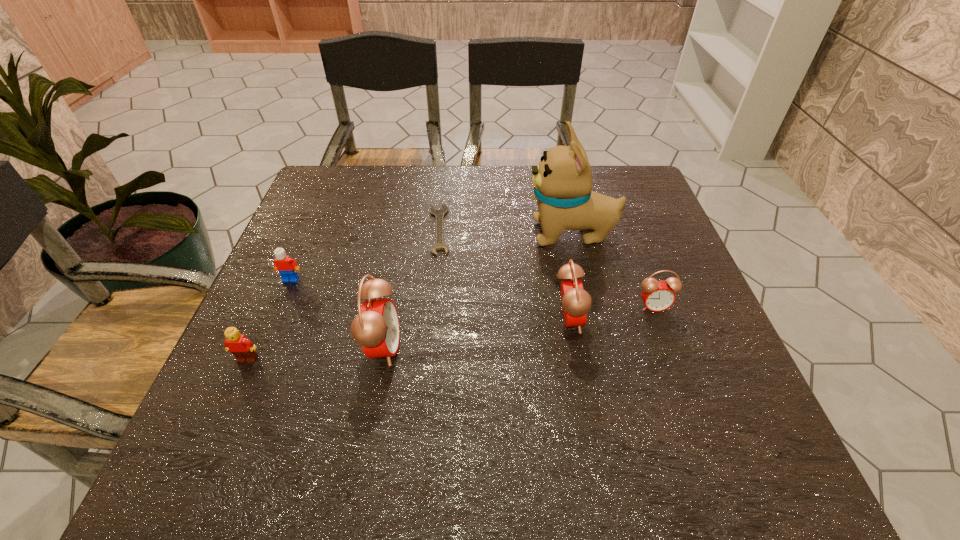
The width and height of the screenshot is (960, 540). In order to click on the leftmost alarm clock in this screenshot , I will do `click(376, 328)`.

This screenshot has width=960, height=540. In order to click on the third tallest object in this screenshot , I will do `click(576, 302)`.

I want to click on the second alarm clock from right to left, so click(x=576, y=302).

Locate an element on the screen. The width and height of the screenshot is (960, 540). the shortest alarm clock is located at coordinates (657, 296).

Image resolution: width=960 pixels, height=540 pixels. I want to click on wrench, so click(x=439, y=214).

This screenshot has width=960, height=540. Identify the location of the shortest object. (439, 214).

Locate an element on the screen. The width and height of the screenshot is (960, 540). the tallest object is located at coordinates (562, 181).

Identify the location of the nearer Lego. The width and height of the screenshot is (960, 540). (242, 348).

Find the location of a particular element. the farther Lego is located at coordinates (283, 263).

This screenshot has width=960, height=540. I want to click on vacant space located on the clock face of the fifth object from right to left, so click(x=465, y=347).